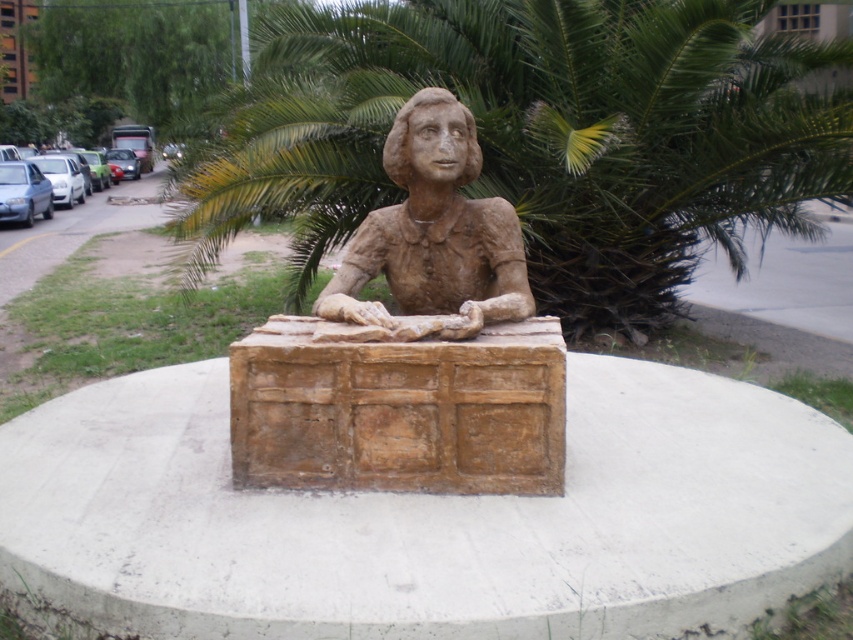
Question: Estimate the real-world distances between objects in this image. Which object is closer to the brown clay bust at center?

Choices:
 (A) matte bronze bust at center
 (B) brown textured cement at center

Answer: (A)

Question: Is brown textured cement at center to the right of green leafy palm tree at center from the viewer's perspective?

Choices:
 (A) no
 (B) yes

Answer: (B)

Question: Does brown textured cement at center have a lesser width compared to brown clay bust at center?

Choices:
 (A) yes
 (B) no

Answer: (B)

Question: Which point is farther to the camera?

Choices:
 (A) green leafy palm tree at center
 (B) brown clay bust at center

Answer: (A)

Question: Can you confirm if green leafy palm tree at center is wider than brown clay bust at center?

Choices:
 (A) no
 (B) yes

Answer: (A)

Question: Which of the following is the farthest from the observer?

Choices:
 (A) brown textured cement at center
 (B) matte bronze bust at center
 (C) green leafy palm tree at center
 (D) brown clay bust at center

Answer: (C)